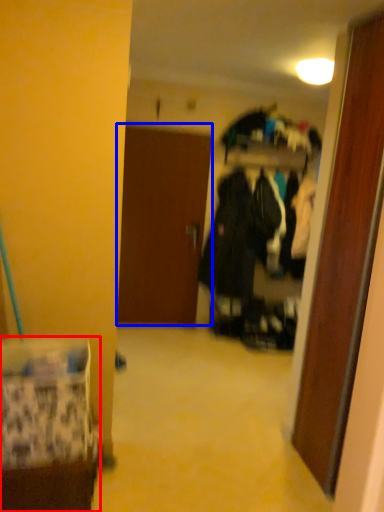
Question: Which object appears closest to the camera in this image, furniture (highlighted by a red box) or door (highlighted by a blue box)?

Choices:
 (A) furniture
 (B) door

Answer: (A)